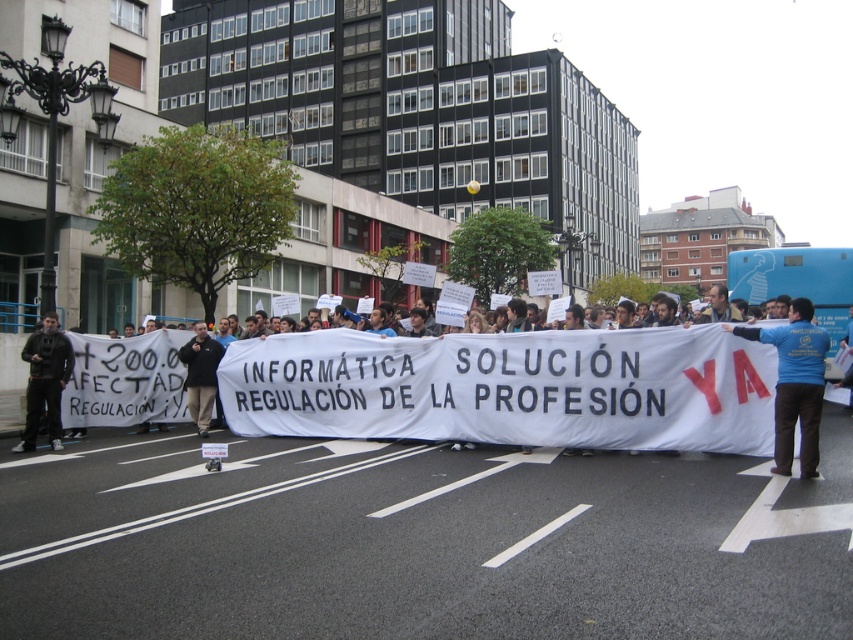
Looking at this image, does blue shirt at center appear over dark gray jacket at left?

Yes.

Between blue shirt at center and dark gray jacket at left, which one is positioned lower?

Positioned lower is dark gray jacket at left.

What do you see at coordinates (509, 387) in the screenshot? I see `blue shirt at center` at bounding box center [509, 387].

This screenshot has height=640, width=853. Find the location of `blue shirt at center`. blue shirt at center is located at coordinates (509, 387).

Does blue shirt at center appear under dark blue shirt at center?

No, blue shirt at center is not below dark blue shirt at center.

Where is `blue shirt at center`? The image size is (853, 640). blue shirt at center is located at coordinates (509, 387).

The height and width of the screenshot is (640, 853). Describe the element at coordinates (795, 385) in the screenshot. I see `blue t-shirt at center` at that location.

Who is shorter, blue t-shirt at center or dark blue shirt at center?

With less height is dark blue shirt at center.

The height and width of the screenshot is (640, 853). What are the coordinates of `blue t-shirt at center` in the screenshot? It's located at (795, 385).